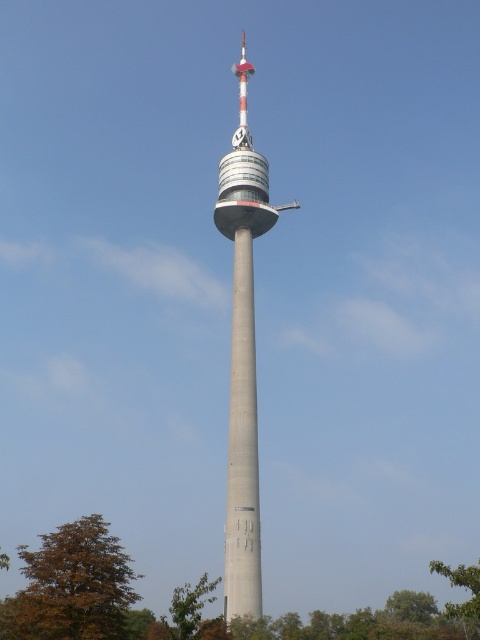
Question: Among these objects, which one is farthest from the camera?

Choices:
 (A) green leafy tree at lower left
 (B) brown leafy tree at lower left
 (C) green leafy tree at lower right

Answer: (A)

Question: Is concrete tower at center bigger than green leafy tree at lower left?

Choices:
 (A) yes
 (B) no

Answer: (A)

Question: Which is farther from the concrete tower at center?

Choices:
 (A) green leafy tree at lower left
 (B) brown leafy tree at lower left
 (C) green leafy tree at lower right

Answer: (C)

Question: Which object is closer to the camera taking this photo?

Choices:
 (A) brown leafy tree at lower left
 (B) concrete tower at center
 (C) green leafy tree at lower left

Answer: (A)

Question: Can you confirm if concrete tower at center is positioned to the right of green leafy tree at lower right?

Choices:
 (A) no
 (B) yes

Answer: (A)

Question: Does concrete tower at center appear on the left side of green leafy tree at lower left?

Choices:
 (A) yes
 (B) no

Answer: (B)